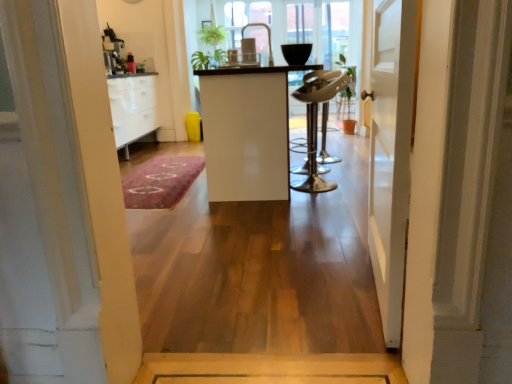
You are a GUI agent. You are given a task and a screenshot of the screen. Output one action in this format:
    pyautogui.click(x=<x>, y=<y>)
    Task: Click on the free spot to the left of white wooden door at center
    This screenshot has width=512, height=384.
    Given the screenshot: What is the action you would take?
    pyautogui.click(x=267, y=273)